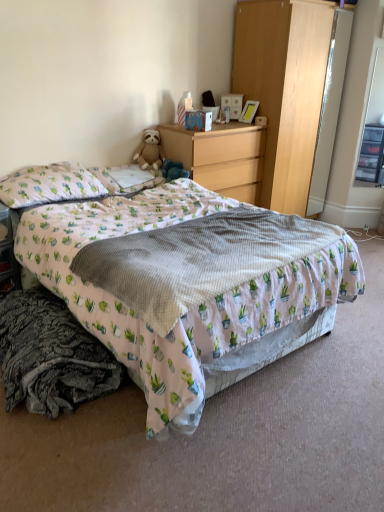
Question: Is soft brown teddy bear at center facing away from wooden chest of drawers at center?

Choices:
 (A) no
 (B) yes

Answer: (A)

Question: Does soft brown teddy bear at center turn towards wooden chest of drawers at center?

Choices:
 (A) yes
 (B) no

Answer: (B)

Question: Is soft brown teddy bear at center next to wooden chest of drawers at center and touching it?

Choices:
 (A) no
 (B) yes

Answer: (A)

Question: Is soft brown teddy bear at center shorter than wooden chest of drawers at center?

Choices:
 (A) yes
 (B) no

Answer: (A)

Question: Considering the relative sizes of soft brown teddy bear at center and wooden chest of drawers at center in the image provided, is soft brown teddy bear at center bigger than wooden chest of drawers at center?

Choices:
 (A) no
 (B) yes

Answer: (A)

Question: Is matte cardboard box at upper center situated inside transparent plastic drawers at right or outside?

Choices:
 (A) inside
 (B) outside

Answer: (B)

Question: In terms of size, does matte cardboard box at upper center appear bigger or smaller than transparent plastic drawers at right?

Choices:
 (A) small
 (B) big

Answer: (A)

Question: Based on their positions, is matte cardboard box at upper center located to the left or right of transparent plastic drawers at right?

Choices:
 (A) right
 (B) left

Answer: (B)

Question: Does point (201, 131) appear closer or farther from the camera than point (375, 101)?

Choices:
 (A) closer
 (B) farther

Answer: (A)

Question: Is wooden table at lower left to the left or to the right of light wood dresser at upper right in the image?

Choices:
 (A) right
 (B) left

Answer: (B)

Question: Is wooden table at lower left spatially inside light wood dresser at upper right, or outside of it?

Choices:
 (A) inside
 (B) outside

Answer: (B)

Question: Relative to light wood dresser at upper right, is wooden table at lower left in front or behind?

Choices:
 (A) front
 (B) behind

Answer: (A)

Question: Considering the positions of point (8, 228) and point (304, 16), is point (8, 228) closer or farther from the camera than point (304, 16)?

Choices:
 (A) farther
 (B) closer

Answer: (B)

Question: From the image's perspective, is white textured blanket at center above or below printed fabric bed at center?

Choices:
 (A) below
 (B) above

Answer: (B)

Question: Looking at their shapes, would you say white textured blanket at center is wider or thinner than printed fabric bed at center?

Choices:
 (A) wide
 (B) thin

Answer: (B)